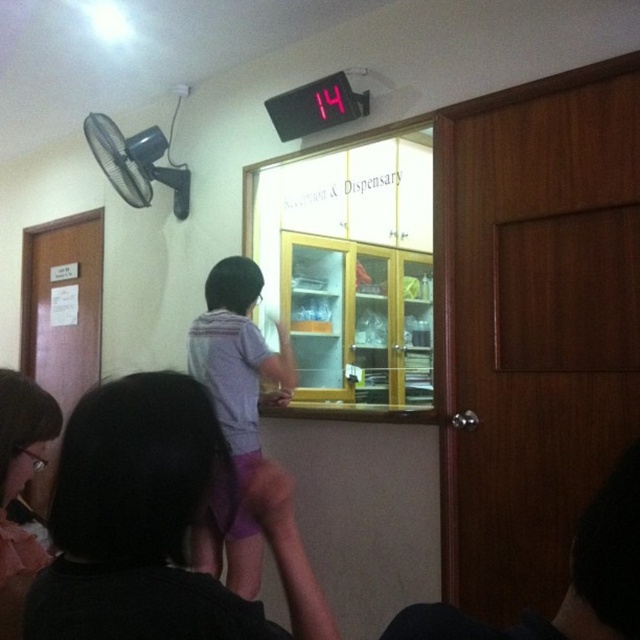
You are a patient in the waiting area and need to sit down. There are two seats available made of purple fabric at center and matte pink fabric at lower left. Which seat is shorter in height?

The purple fabric at center is not as tall as matte pink fabric at lower left, so the seat made of purple fabric at center is shorter in height.

You are a healthcare worker in the reception area and need to place a small medical kit on the floor. The purple cotton shorts at center and the matte pink fabric at lower left are in the way. Which object should you move to make space?

The purple cotton shorts at center is bigger than the matte pink fabric at lower left, so you should move the purple cotton shorts at center to create enough space for the medical kit.

You are a receptionist in the healthcare facility and you see the dark hair at center and the purple fabric at center. Which one is closer to the left side of the room?

The dark hair at center is closer to the left side of the room because it is positioned to the left of the purple fabric at center.